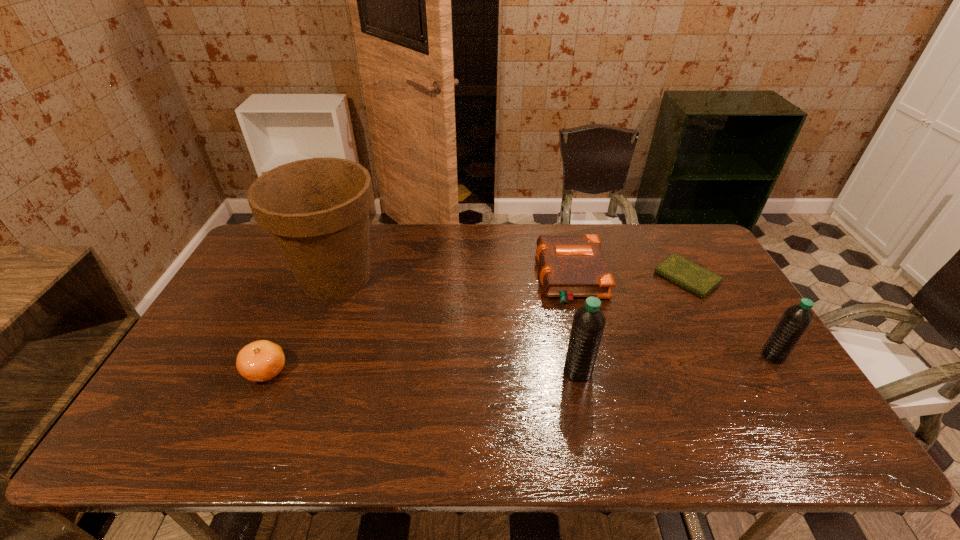
The width and height of the screenshot is (960, 540). In order to click on the taller water bottle in this screenshot , I will do `click(588, 324)`.

Where is `the fifth shortest object`? Image resolution: width=960 pixels, height=540 pixels. the fifth shortest object is located at coordinates (588, 324).

I want to click on the third tallest object, so click(x=796, y=319).

The width and height of the screenshot is (960, 540). I want to click on the shorter water bottle, so click(796, 319).

Identify the location of Bible. This screenshot has height=540, width=960. 571,266.

I want to click on the tallest object, so click(x=317, y=210).

I want to click on the shortest object, so click(x=694, y=278).

Locate an element on the screen. The height and width of the screenshot is (540, 960). the third shortest object is located at coordinates (260, 361).

Where is `vacant space situated on the back of the left water bottle`? The height and width of the screenshot is (540, 960). vacant space situated on the back of the left water bottle is located at coordinates (557, 271).

Find the location of `vacant space situated 0.230m on the left of the third tallest object`. vacant space situated 0.230m on the left of the third tallest object is located at coordinates (676, 356).